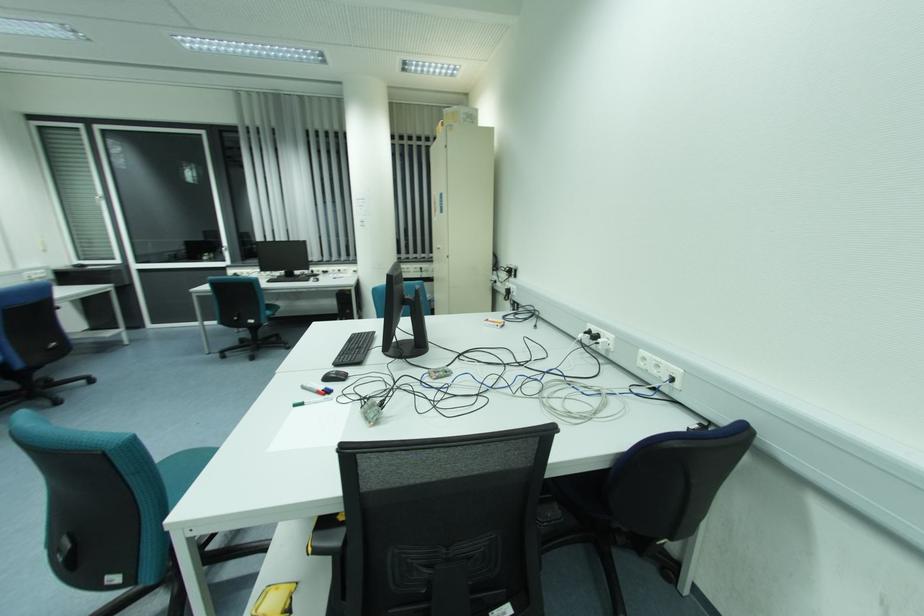
What do you see at coordinates (180, 466) in the screenshot? Image resolution: width=924 pixels, height=616 pixels. I see `a teal chair sitting surface` at bounding box center [180, 466].